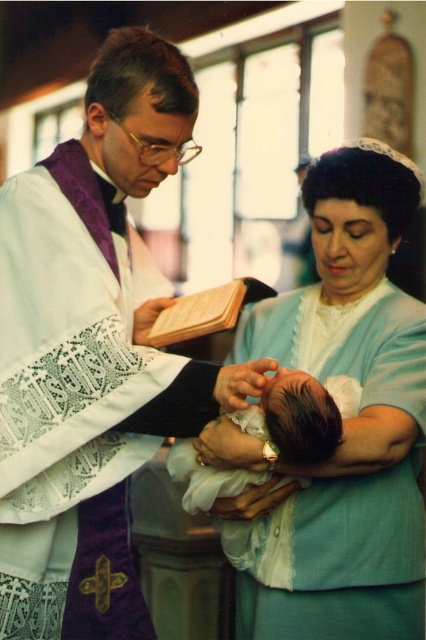
Is point (143, 397) more distant than point (307, 292)?

No, it is not.

Is point (143, 627) less distant than point (319, 161)?

Yes.

This screenshot has width=426, height=640. Describe the element at coordinates (92, 352) in the screenshot. I see `purple lace fabric at center` at that location.

Identify the location of purple lace fabric at center. (92, 352).

Looking at this image, does light blue fabric dress at center appear over dark brown hair at center?

Yes.

How much distance is there between light blue fabric dress at center and dark brown hair at center?

light blue fabric dress at center is 13.21 inches from dark brown hair at center.

Is point (348, 368) positioned behind point (288, 394)?

Yes, point (348, 368) is farther from viewer.

Locate an element on the screen. light blue fabric dress at center is located at coordinates (344, 419).

Which is above, purple lace fabric at center or dark brown hair at center?

purple lace fabric at center is higher up.

Does purple lace fabric at center appear on the right side of dark brown hair at center?

No, purple lace fabric at center is not to the right of dark brown hair at center.

Is point (109, 44) closer to camera compared to point (290, 440)?

That is False.

At what (x,y) coordinates should I click in order to perform the action: click on purple lace fabric at center. Please return your answer as a coordinate pair (x, y). Image resolution: width=426 pixels, height=640 pixels. Looking at the image, I should click on (92, 352).